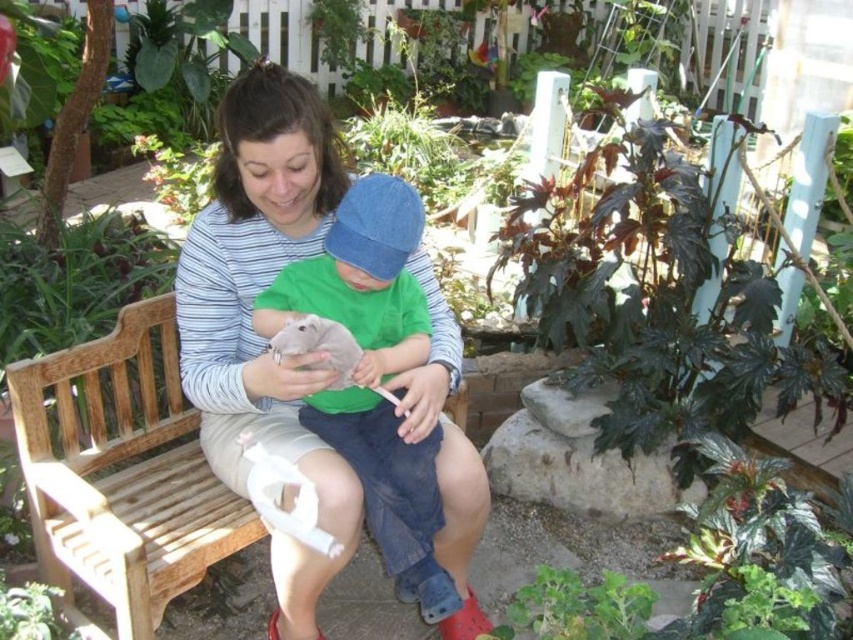
Does green leafy plant at upper center appear under green leafy plant at lower left?

No, green leafy plant at upper center is not below green leafy plant at lower left.

Can you confirm if green leafy plant at upper center is taller than green leafy plant at lower left?

Yes, green leafy plant at upper center is taller than green leafy plant at lower left.

Who is more forward, (181, 179) or (67, 621)?

Point (67, 621) is in front.

Identify the location of green leafy plant at upper center. The width and height of the screenshot is (853, 640). (178, 173).

Can you confirm if wooden bench at center is thinner than green fuzzy plant at lower center?

No, wooden bench at center is not thinner than green fuzzy plant at lower center.

Who is higher up, wooden bench at center or green fuzzy plant at lower center?

Positioned higher is wooden bench at center.

At what (x,y) coordinates should I click in order to perform the action: click on wooden bench at center. Please return your answer as a coordinate pair (x, y). Image resolution: width=853 pixels, height=640 pixels. Looking at the image, I should click on (122, 474).

From the picture: Does wooden bench at center appear over green leafy plant at lower left?

Yes.

Who is lower down, wooden bench at center or green leafy plant at lower left?

green leafy plant at lower left

The width and height of the screenshot is (853, 640). I want to click on wooden bench at center, so click(x=122, y=474).